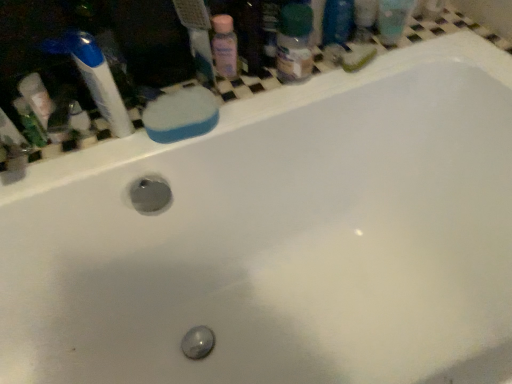
Question: Is point (182, 130) positioned closer to the camera than point (218, 21)?

Choices:
 (A) closer
 (B) farther

Answer: (A)

Question: Considering the positions of blue sponge at upper left and pink plastic bottle at upper center in the image, is blue sponge at upper left taller or shorter than pink plastic bottle at upper center?

Choices:
 (A) short
 (B) tall

Answer: (A)

Question: Which object is the closest to the pink plastic bottle at upper center?

Choices:
 (A) blue sponge at upper left
 (B) translucent plastic bottle at upper right
 (C) green matte bottle at left
 (D) blue plastic toothbrush at upper left

Answer: (B)

Question: Based on their relative distances, which object is nearer to the green matte bottle at left?

Choices:
 (A) blue plastic toothbrush at upper left
 (B) pink plastic bottle at upper center
 (C) blue sponge at upper left
 (D) translucent plastic bottle at upper right

Answer: (A)